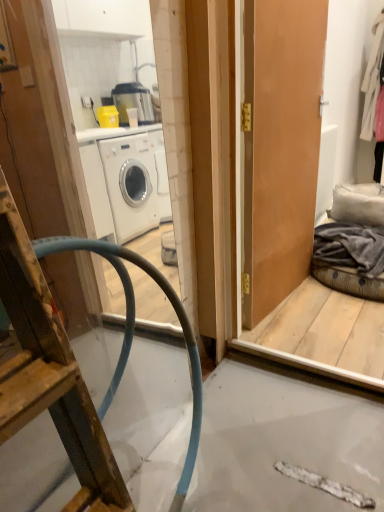
Question: Are white wool coat at upper right, the second clothing in the left-to-right sequence, and white textured radiator at right making contact?

Choices:
 (A) no
 (B) yes

Answer: (A)

Question: Does white wool coat at upper right, which is the first clothing in right-to-left order, have a larger size compared to white textured radiator at right?

Choices:
 (A) no
 (B) yes

Answer: (B)

Question: Does white wool coat at upper right, which is the first clothing in right-to-left order, have a greater width compared to white textured radiator at right?

Choices:
 (A) no
 (B) yes

Answer: (B)

Question: Does white wool coat at upper right, the 1th clothing from the back, have a lesser width compared to white textured radiator at right?

Choices:
 (A) no
 (B) yes

Answer: (A)

Question: Is white wool coat at upper right, arranged as the 2th clothing when viewed from the front, not close to white textured radiator at right?

Choices:
 (A) yes
 (B) no

Answer: (B)

Question: Considering the relative positions of white wool coat at upper right, the second clothing in the left-to-right sequence, and white textured radiator at right in the image provided, is white wool coat at upper right, the second clothing in the left-to-right sequence, to the right of white textured radiator at right from the viewer's perspective?

Choices:
 (A) no
 (B) yes

Answer: (B)

Question: Can you confirm if white wool coat at upper right, the 1th clothing from the top, is taller than gray cotton blanket at right, which is counted as the second clothing, starting from the top?

Choices:
 (A) no
 (B) yes

Answer: (B)

Question: Is white wool coat at upper right, arranged as the 2th clothing when viewed from the front, wider than gray cotton blanket at right, the 2th clothing viewed from the back?

Choices:
 (A) no
 (B) yes

Answer: (A)

Question: Is white wool coat at upper right, the second clothing in the left-to-right sequence, oriented towards gray cotton blanket at right, the 2th clothing viewed from the back?

Choices:
 (A) no
 (B) yes

Answer: (A)

Question: Can you confirm if white wool coat at upper right, arranged as the 2th clothing when viewed from the front, is positioned to the left of gray cotton blanket at right, the 2th clothing in the right-to-left sequence?

Choices:
 (A) yes
 (B) no

Answer: (B)

Question: Does white wool coat at upper right, which is the first clothing in right-to-left order, have a larger size compared to gray cotton blanket at right, the 2th clothing in the right-to-left sequence?

Choices:
 (A) no
 (B) yes

Answer: (B)

Question: From the image's perspective, is white wool coat at upper right, the second clothing in the left-to-right sequence, above gray cotton blanket at right, which is counted as the second clothing, starting from the top?

Choices:
 (A) yes
 (B) no

Answer: (A)

Question: Would you say blue rubber hose at left contains white textured radiator at right?

Choices:
 (A) no
 (B) yes

Answer: (A)